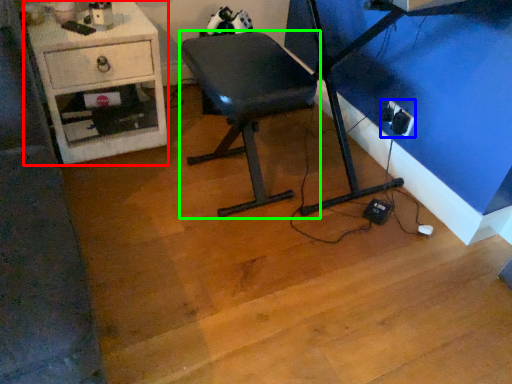
Question: Considering the real-world distances, which object is closest to desk (highlighted by a red box)? electric outlet (highlighted by a blue box) or furniture (highlighted by a green box).

Choices:
 (A) electric outlet
 (B) furniture

Answer: (B)